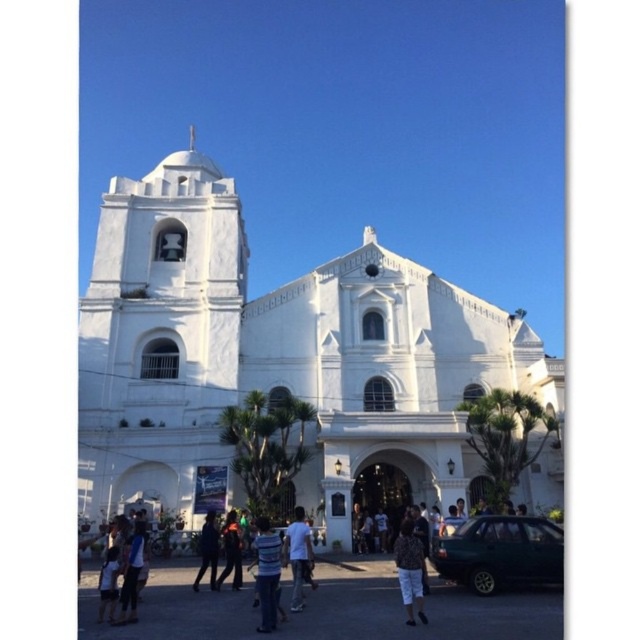
Question: Is printed fabric shorts at lower center positioned at the back of dark blue jeans at center?

Choices:
 (A) yes
 (B) no

Answer: (B)

Question: Is green matte car at lower right smaller than dark blue jeans at center?

Choices:
 (A) yes
 (B) no

Answer: (B)

Question: Can you confirm if white smooth church at center is positioned to the left of printed fabric shorts at lower center?

Choices:
 (A) no
 (B) yes

Answer: (B)

Question: Which point is closer to the camera taking this photo?

Choices:
 (A) (100, 604)
 (B) (214, 529)

Answer: (A)

Question: Which point appears closest to the camera in this image?

Choices:
 (A) (168, 403)
 (B) (236, 529)
 (C) (268, 536)

Answer: (C)

Question: Which point is farther to the camera?

Choices:
 (A) (237, 298)
 (B) (298, 589)

Answer: (A)